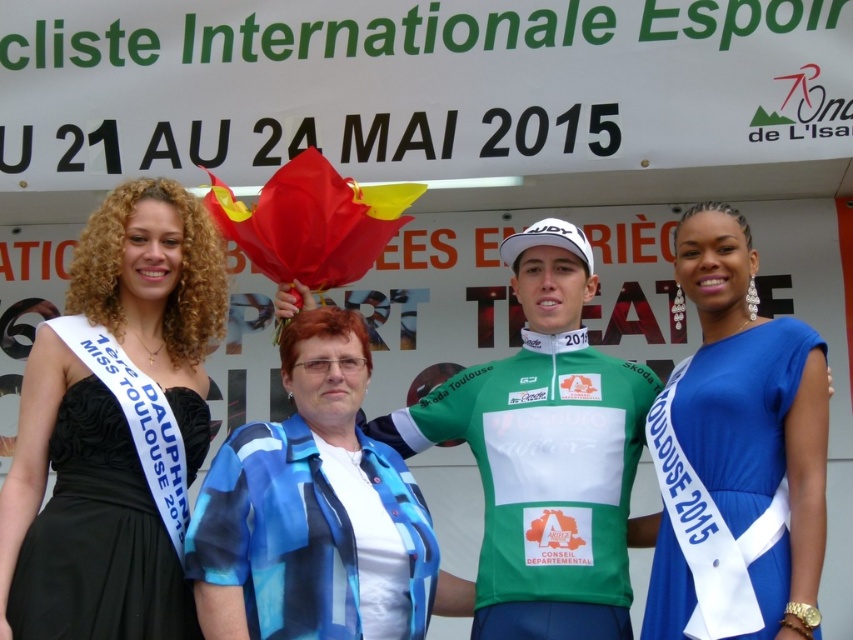
Question: Is black satin dress at upper left above blue printed shirt at center?

Choices:
 (A) no
 (B) yes

Answer: (B)

Question: Which of these objects is positioned farthest from the green jersey at center?

Choices:
 (A) blue satin dress at center
 (B) black satin dress at upper left

Answer: (B)

Question: Which point is closer to the camera?

Choices:
 (A) (614, 433)
 (B) (120, 211)
 (C) (685, 525)

Answer: (C)

Question: Can you confirm if black satin dress at upper left is positioned below blue printed shirt at center?

Choices:
 (A) yes
 (B) no

Answer: (B)

Question: Can you confirm if black satin dress at upper left is positioned to the right of green jersey at center?

Choices:
 (A) no
 (B) yes

Answer: (A)

Question: Among these points, which one is nearest to the camera?

Choices:
 (A) (596, 582)
 (B) (709, 410)
 (C) (294, 440)

Answer: (A)